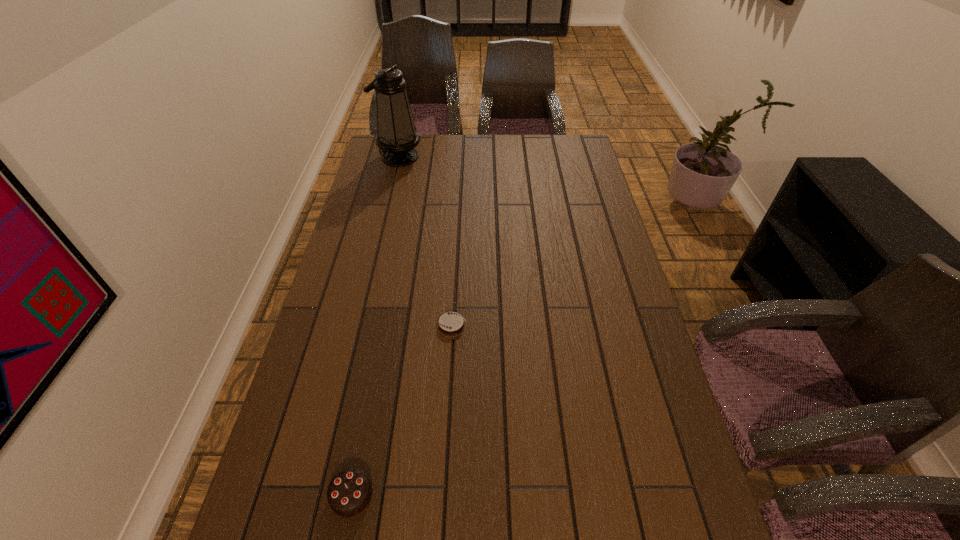
Find the location of a particular element. The image size is (960, 540). oil lamp at the left edge is located at coordinates (397, 137).

You are a GUI agent. You are given a task and a screenshot of the screen. Output one action in this format:
    pyautogui.click(x=<x>, y=<y>)
    Task: Click on the chocolate cake located in the left edge section of the desktop
    The height and width of the screenshot is (540, 960).
    Given the screenshot: What is the action you would take?
    point(349,492)

The height and width of the screenshot is (540, 960). I want to click on object that is at the far left corner, so click(397, 137).

In the image, there is a desktop. Where is `vacant space at the far edge`? Image resolution: width=960 pixels, height=540 pixels. vacant space at the far edge is located at coordinates (543, 138).

Find the location of a particular element. This screenshot has height=540, width=960. free location at the left edge is located at coordinates (272, 460).

The width and height of the screenshot is (960, 540). Find the location of `vacant region at the right edge of the desktop`. vacant region at the right edge of the desktop is located at coordinates (617, 312).

Locate an element on the screen. The image size is (960, 540). free region at the far left corner is located at coordinates (374, 163).

Find the location of `free spot at the far right corner of the desktop`. free spot at the far right corner of the desktop is located at coordinates (586, 153).

The image size is (960, 540). I want to click on free space between the tallest object and the nearer chocolate cake, so click(375, 326).

Where is `unoccupied area between the nearer chocolate cake and the shorter chocolate cake`? unoccupied area between the nearer chocolate cake and the shorter chocolate cake is located at coordinates (401, 410).